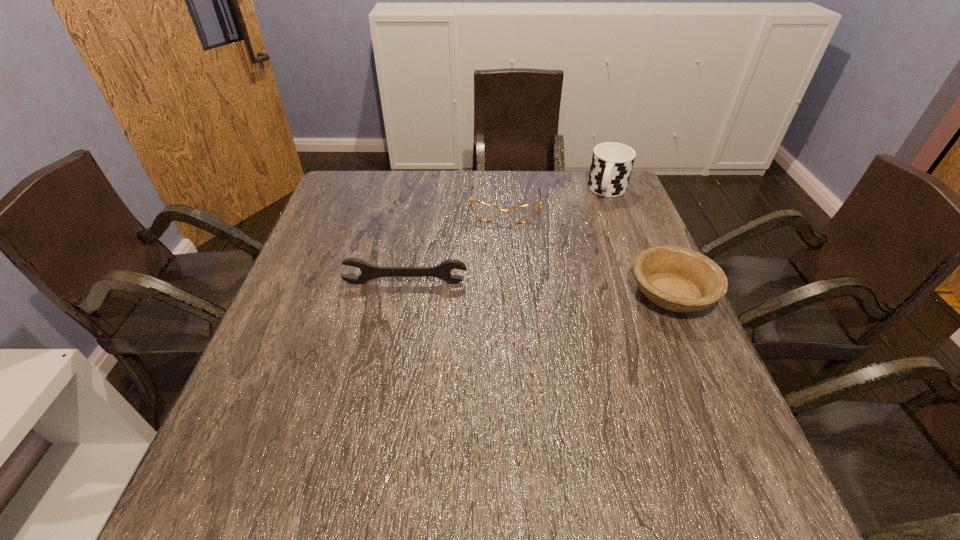
At what (x,y) coordinates should I click in order to perform the action: click on blank space located 0.290m on the side of the tallest object with the handle. Please return your answer as a coordinate pair (x, y). Looking at the image, I should click on (585, 261).

Find the location of a particular element. This screenshot has width=960, height=540. vacant space situated 0.150m on the side of the tallest object with the handle is located at coordinates (595, 231).

This screenshot has width=960, height=540. I want to click on spectacles positioned at the far edge, so click(x=486, y=212).

I want to click on cup situated at the far edge, so click(x=612, y=163).

The width and height of the screenshot is (960, 540). I want to click on object at the left edge, so click(368, 272).

Where is `bowl at the right edge`? bowl at the right edge is located at coordinates coord(675,278).

Find the location of a particular element. cup that is positioned at the right edge is located at coordinates (612, 163).

At what (x,y) coordinates should I click in order to perform the action: click on object that is positioned at the far right corner. Please return your answer as a coordinate pair (x, y). Looking at the image, I should click on (612, 163).

In the image, there is a desktop. At what (x,y) coordinates should I click in order to perform the action: click on vacant space at the near edge. Please return your answer as a coordinate pair (x, y). Looking at the image, I should click on (x=318, y=441).

Find the location of a particular element. Image resolution: width=960 pixels, height=540 pixels. free region at the left edge of the desktop is located at coordinates (337, 348).